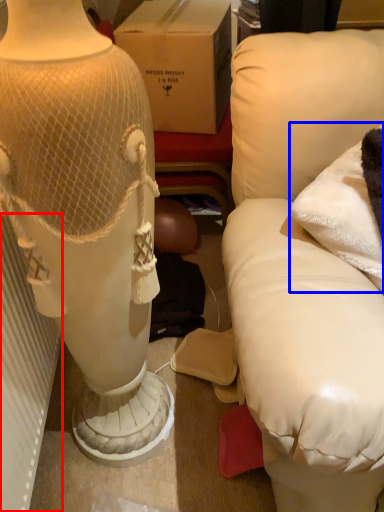
Question: Which point is closer to the camera, radiator (highlighted by a red box) or pillow (highlighted by a blue box)?

Choices:
 (A) radiator
 (B) pillow

Answer: (A)